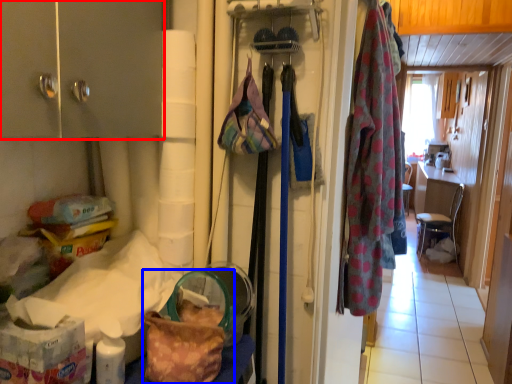
Question: Among these objects, which one is nearest to the camera, cabinetry (highlighted by a red box) or handbag (highlighted by a blue box)?

Choices:
 (A) cabinetry
 (B) handbag

Answer: (A)